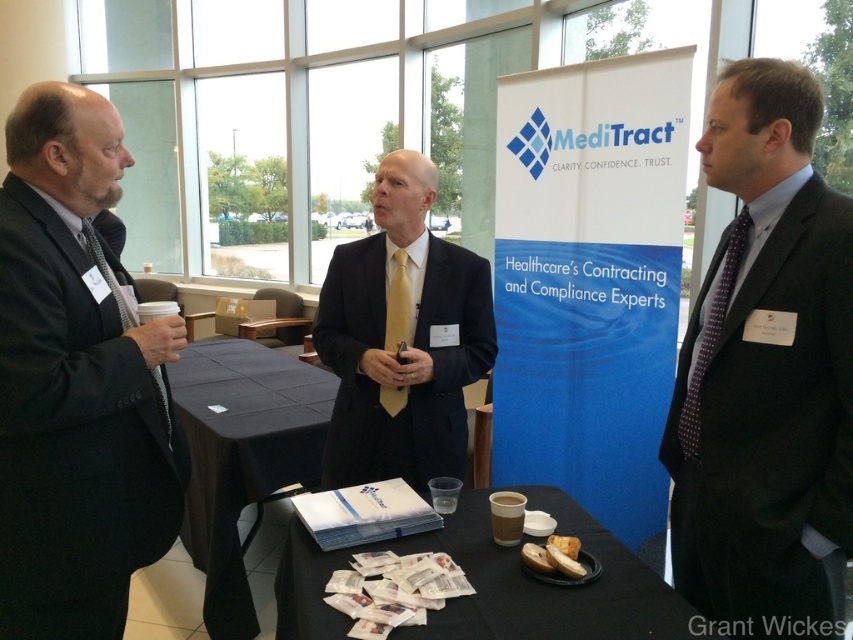
You are a guest at this event and need to place your coat on the table. Considering the distance between you and the black fabric table at lower left, can you reach it without moving closer?

The black fabric table at lower left is 2.46 meters away from you. Since the average human arm length is about 0.7 meters, you cannot reach it without moving closer.